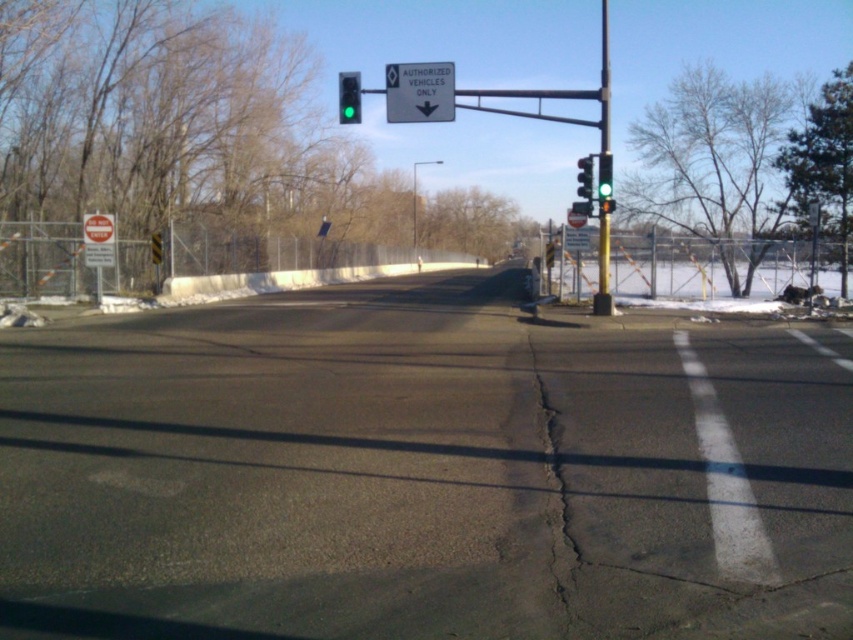
From the picture: You are a delivery driver approaching the intersection and notice a metallic pole at right. You need to park your vehicle 25 meters away from the pole to avoid blocking the camera. Can you park your vehicle at the current position?

The metallic pole at right and camera are 23.60 meters apart from each other. Since the required distance is 25 meters, parking at the current position would be too close. You need to move your vehicle further away to ensure it is at least 25 meters from the pole.